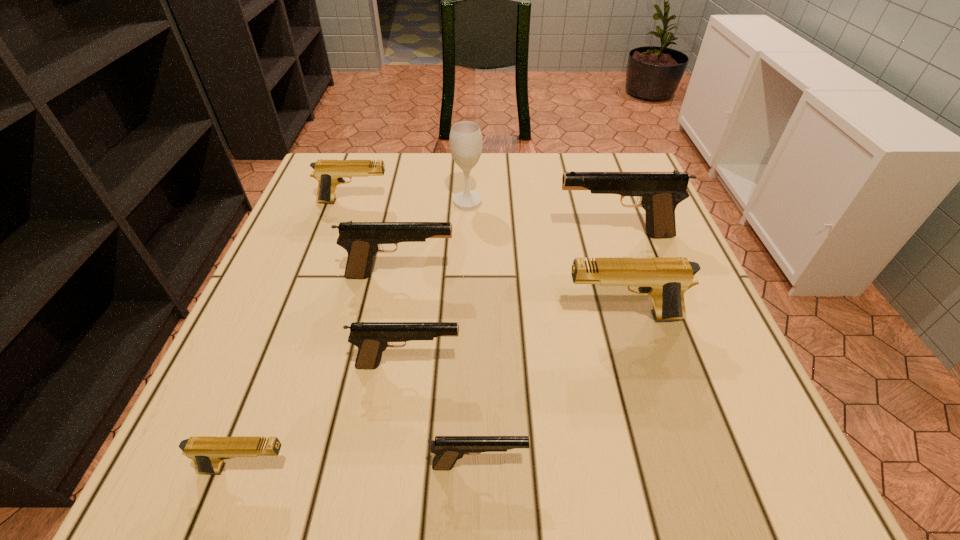
Find the location of `vacant space located 0.210m at the muzzle of the third farthest pistol`. vacant space located 0.210m at the muzzle of the third farthest pistol is located at coordinates (556, 275).

This screenshot has width=960, height=540. In order to click on vacant space located 0.080m at the barrel of the farthest pistol in this screenshot , I will do `click(422, 201)`.

The image size is (960, 540). In order to click on free space located at the muzzle of the third farthest black pistol in this screenshot , I will do `click(554, 364)`.

Locate an element on the screen. This screenshot has height=540, width=960. free space located at the barrel of the smallest tan pistol is located at coordinates (468, 469).

Where is `free location located at the muzzle of the nearest black pistol`? The width and height of the screenshot is (960, 540). free location located at the muzzle of the nearest black pistol is located at coordinates (678, 464).

I want to click on wineglass present at the far edge, so click(465, 140).

You are a GUI agent. You are given a task and a screenshot of the screen. Output one action in this format:
    pyautogui.click(x=<x>, y=<y>)
    Task: Click on the pistol that is at the far edge
    
    Given the screenshot: What is the action you would take?
    pyautogui.click(x=328, y=173)

Locate an element on the screen. object at the far left corner is located at coordinates (328, 173).

Locate an element on the screen. Image resolution: width=960 pixels, height=540 pixels. object that is positioned at the near left corner is located at coordinates (208, 453).

In the image, there is a desktop. Identify the location of free space at the far edge. (515, 193).